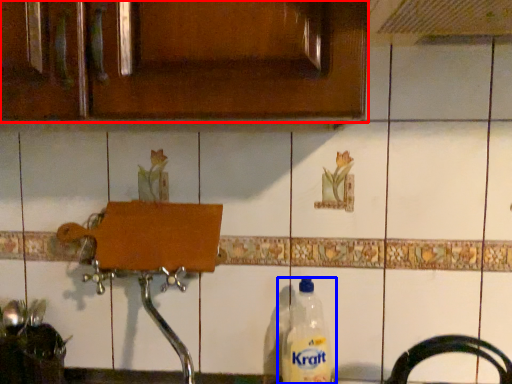
Question: Which of the following is the closest to the observer, cabinetry (highlighted by a red box) or bottle (highlighted by a blue box)?

Choices:
 (A) cabinetry
 (B) bottle

Answer: (A)